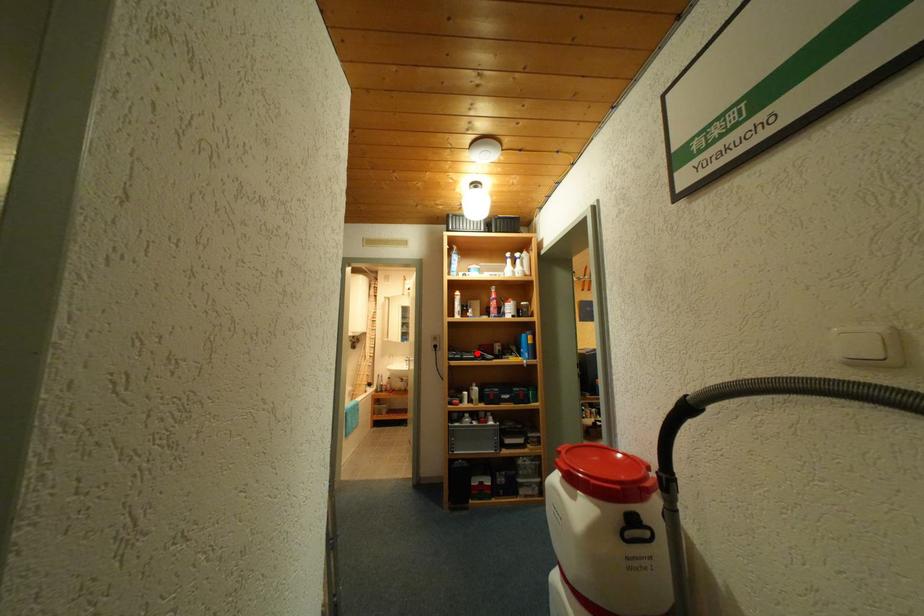
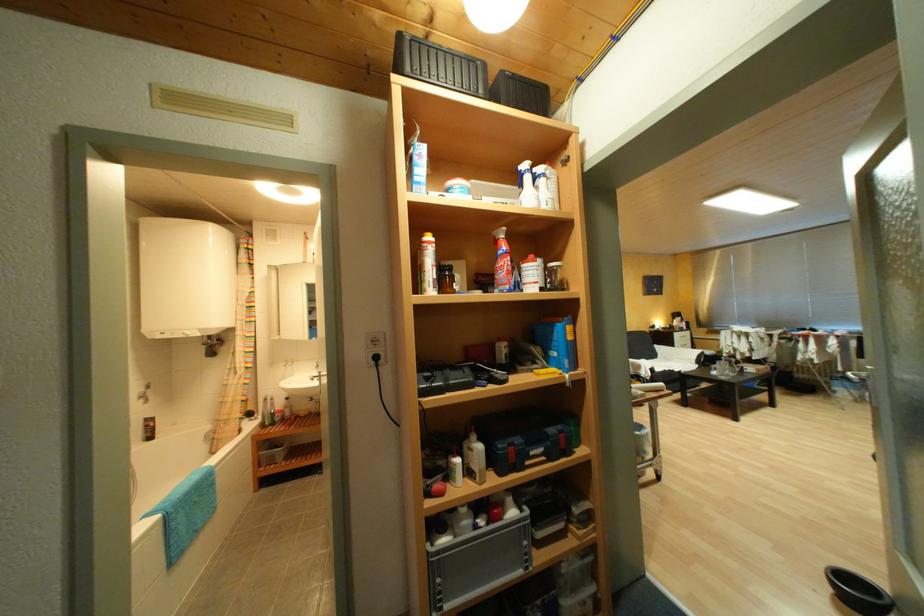
Where in the second image is the point corresponding to the highlighted location from the first image?

(463, 368)